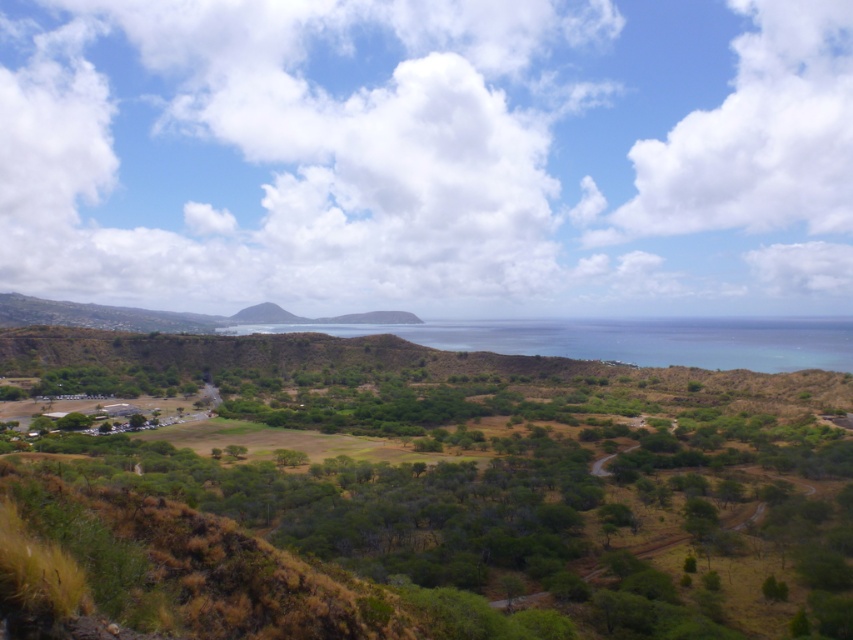
You are a hiker standing at the edge of the green grassy hill at center, looking towards the blue water at center. Which object is higher in elevation?

The blue water at center has a greater height compared to the green grassy hill at center, so the blue water at center is higher in elevation.

You are a hiker planning to cross the blue water at center and the green grassy hill at center. Based on their widths, which one do you think is safer to cross?

The blue water at center is wider than the green grassy hill at center, so crossing the green grassy hill at center would be safer since it is narrower.